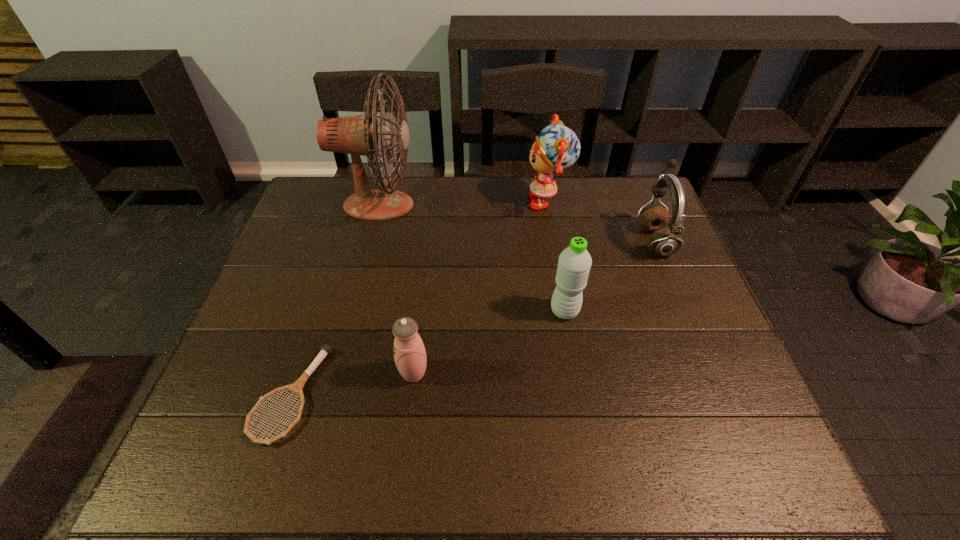
Where is `free space at the right edge of the desktop`? This screenshot has width=960, height=540. free space at the right edge of the desktop is located at coordinates (719, 405).

Identify the location of free space at the far left corner. (336, 207).

In the image, there is a desktop. At what (x,y) coordinates should I click in order to perform the action: click on vacant space at the far right corner. Please return your answer as a coordinate pair (x, y). This screenshot has width=960, height=540. Looking at the image, I should click on (612, 201).

Where is `free space between the fourth farthest object and the rightmost object`? The image size is (960, 540). free space between the fourth farthest object and the rightmost object is located at coordinates (610, 276).

Find the location of a particular element. The image size is (960, 540). vacant region between the rightmost object and the fifth tallest object is located at coordinates (534, 307).

Identify the location of free point between the earphone and the shortest object. (472, 318).

The height and width of the screenshot is (540, 960). Find the location of `free spot between the doll and the tallest object`. free spot between the doll and the tallest object is located at coordinates (464, 204).

The image size is (960, 540). I want to click on free spot between the earphone and the fifth tallest object, so pyautogui.click(x=534, y=307).

Locate an element on the screen. This screenshot has height=540, width=960. empty space between the shortest object and the tallest object is located at coordinates (335, 300).

This screenshot has width=960, height=540. Find the location of `unoccupied area between the tallest object and the shortest object`. unoccupied area between the tallest object and the shortest object is located at coordinates (335, 300).